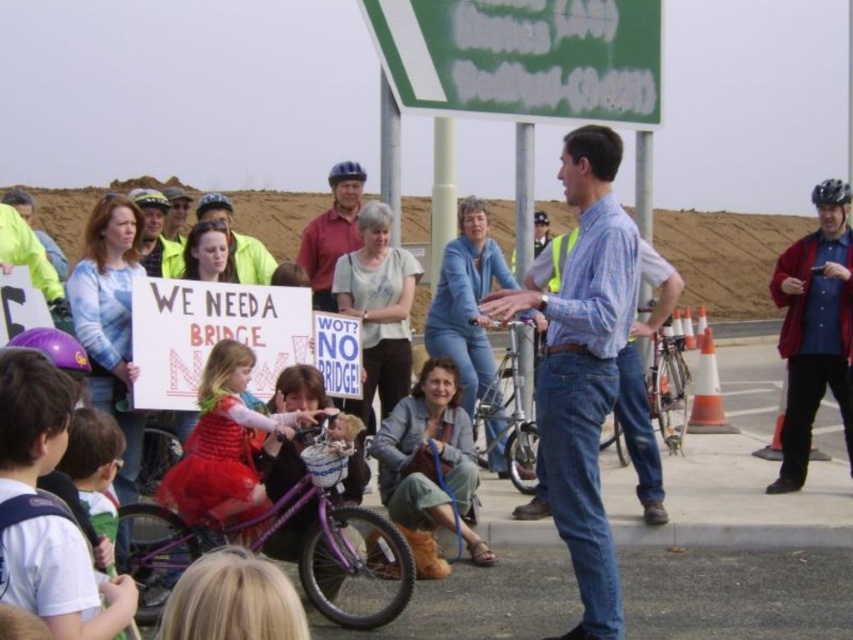
You are a city planner evaluating the space requirements for a new bike rack. You observe the metallic purple bicycle at center and the matte yellow helmet at upper center in the image. Which object takes up more space in the scene?

The metallic purple bicycle at center occupies less space than the matte yellow helmet at upper center, so the matte yellow helmet at upper center takes up more space in the scene.

You are a photographer at the event and want to capture a photo of the metallic purple bicycle at center. Where should you position yourself to ensure the bicycle is centered in your frame?

Position yourself directly in front of the metallic purple bicycle at center to center it in your frame, as its 2D location is at point (509, 413).

You are a photographer trying to capture a photo that includes both the green plastic sign at upper center and the matte red shirt at center. What is the minimum distance you need to move backward to ensure both objects are in frame?

The green plastic sign at upper center and the matte red shirt at center are 11.20 meters apart from each other. To capture both in frame, you need to move back at least 11.20 meters to ensure both are visible.